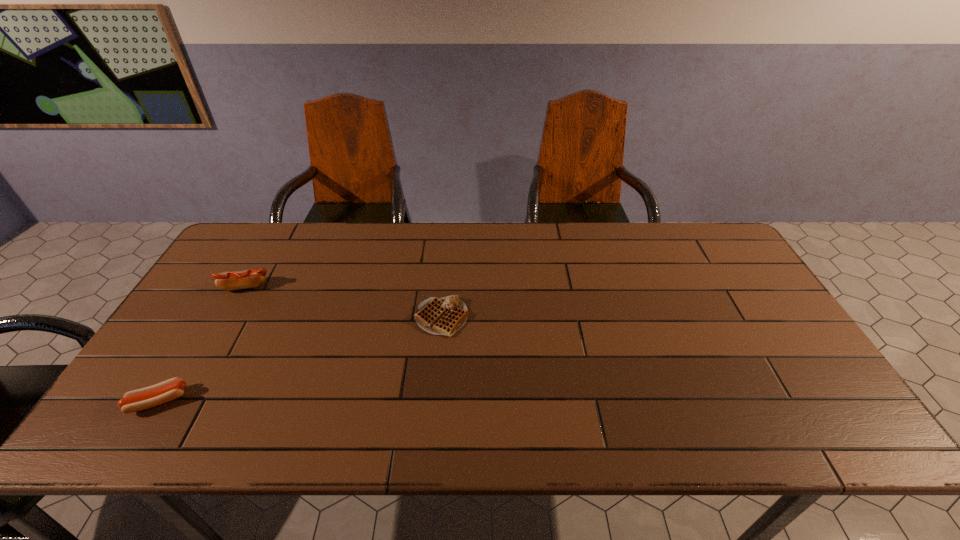
In order to click on object present at the near left corner in this screenshot , I will do `click(148, 397)`.

Identify the location of free point at the far edge. (371, 257).

Identify the location of vacant area at the near edge of the desktop. The image size is (960, 540). (266, 442).

Where is `vacant space at the far left corner of the desktop`? The image size is (960, 540). vacant space at the far left corner of the desktop is located at coordinates (241, 231).

At what (x,y) coordinates should I click in order to perform the action: click on vacant region at the far right corner of the desktop. Please return your answer as a coordinate pair (x, y). The height and width of the screenshot is (540, 960). Looking at the image, I should click on (686, 255).

You are a GUI agent. You are given a task and a screenshot of the screen. Output one action in this format:
    pyautogui.click(x=<x>, y=<y>)
    Task: Click on the vacant space in between the second tallest object and the second nearest object
    The width and height of the screenshot is (960, 540).
    Given the screenshot: What is the action you would take?
    pyautogui.click(x=300, y=359)

This screenshot has height=540, width=960. I want to click on free space that is in between the farthest object and the second farthest object, so click(344, 302).

You are a GUI agent. You are given a task and a screenshot of the screen. Output one action in this format:
    pyautogui.click(x=<x>, y=<y>)
    Task: Click on the blank region between the waffle and the taller sausage
    The width and height of the screenshot is (960, 540).
    Given the screenshot: What is the action you would take?
    pyautogui.click(x=344, y=302)

In order to click on empty space between the taller sausage and the waffle in this screenshot , I will do `click(344, 302)`.

Where is `free spot between the second nearest object and the second tallest object`? The width and height of the screenshot is (960, 540). free spot between the second nearest object and the second tallest object is located at coordinates (300, 359).